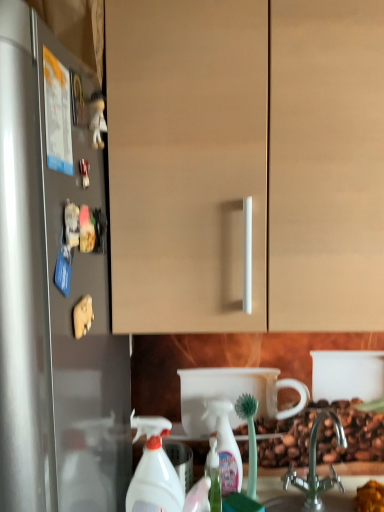
Locate an element on the screen. The width and height of the screenshot is (384, 512). white plastic spray bottle at lower center, which is the 2th cleaning product in left-to-right order is located at coordinates (226, 447).

This screenshot has height=512, width=384. What are the coordinates of `translucent plastic soap dispenser at lower center` in the screenshot? It's located at (213, 476).

In order to face silver metallic faucet at lower center, should I rotate leftwards or rightwards?

You should look right and rotate roughly 16.482 degrees.

Where is `white plastic spray bottle at lower center, which is the first cleaning product from back to front`? This screenshot has height=512, width=384. white plastic spray bottle at lower center, which is the first cleaning product from back to front is located at coordinates (226, 447).

Are white plastic spray bottle at lower center, the 1th cleaning product viewed from the left, and white plastic spray bottle at lower center, which is the first cleaning product from back to front, making contact?

No, white plastic spray bottle at lower center, the 1th cleaning product viewed from the left, is not making contact with white plastic spray bottle at lower center, which is the first cleaning product from back to front.

Considering the positions of points (163, 468) and (232, 441), is point (163, 468) closer to camera compared to point (232, 441)?

Yes, it is in front of point (232, 441).

Is white plastic spray bottle at lower center, arranged as the first cleaning product when viewed from the front, aimed at white plastic spray bottle at lower center, which appears as the first cleaning product when viewed from the right?

No, white plastic spray bottle at lower center, arranged as the first cleaning product when viewed from the front, is not aimed at white plastic spray bottle at lower center, which appears as the first cleaning product when viewed from the right.

Who is bigger, white plastic spray bottle at lower center, which is the first cleaning product from back to front, or silver metallic faucet at lower center?

With larger size is silver metallic faucet at lower center.

Is white plastic spray bottle at lower center, which is the 2th cleaning product in left-to-right order, directly adjacent to silver metallic faucet at lower center?

No, white plastic spray bottle at lower center, which is the 2th cleaning product in left-to-right order, is not with silver metallic faucet at lower center.

Is white plastic spray bottle at lower center, which appears as the first cleaning product when viewed from the right, oriented towards silver metallic faucet at lower center?

No, white plastic spray bottle at lower center, which appears as the first cleaning product when viewed from the right, is not oriented towards silver metallic faucet at lower center.

Which is more to the left, white plastic spray bottle at lower center, which is the first cleaning product from back to front, or silver metallic faucet at lower center?

white plastic spray bottle at lower center, which is the first cleaning product from back to front, is more to the left.

Looking at this image, what's the angular difference between translucent plastic soap dispenser at lower center and white plastic spray bottle at lower center, which ranks as the second cleaning product in right-to-left order,'s facing directions?

There is a 0.0064-degree angle between the facing directions of translucent plastic soap dispenser at lower center and white plastic spray bottle at lower center, which ranks as the second cleaning product in right-to-left order.

Is translucent plastic soap dispenser at lower center next to white plastic spray bottle at lower center, which ranks as the second cleaning product in right-to-left order, and touching it?

They are not placed beside each other.

In the image, is translucent plastic soap dispenser at lower center on the left side or the right side of white plastic spray bottle at lower center, which ranks as the second cleaning product in right-to-left order?

translucent plastic soap dispenser at lower center is positioned on white plastic spray bottle at lower center, which ranks as the second cleaning product in right-to-left order,'s right side.

From the image's perspective, between translucent plastic soap dispenser at lower center and white plastic spray bottle at lower center, arranged as the first cleaning product when viewed from the front, who is located below?

translucent plastic soap dispenser at lower center is shown below in the image.

Would you say white plastic spray bottle at lower center, arranged as the first cleaning product when viewed from the front, is inside or outside translucent plastic soap dispenser at lower center?

white plastic spray bottle at lower center, arranged as the first cleaning product when viewed from the front, is not enclosed by translucent plastic soap dispenser at lower center.

Considering the relative sizes of white plastic spray bottle at lower center, which ranks as the second cleaning product in right-to-left order, and translucent plastic soap dispenser at lower center in the image provided, is white plastic spray bottle at lower center, which ranks as the second cleaning product in right-to-left order, shorter than translucent plastic soap dispenser at lower center?

In fact, white plastic spray bottle at lower center, which ranks as the second cleaning product in right-to-left order, may be taller than translucent plastic soap dispenser at lower center.

How different are the orientations of white plastic spray bottle at lower center, arranged as the first cleaning product when viewed from the front, and translucent plastic soap dispenser at lower center in degrees?

The angular difference between white plastic spray bottle at lower center, arranged as the first cleaning product when viewed from the front, and translucent plastic soap dispenser at lower center is 0.0064 degrees.

Does white plastic spray bottle at lower center, the 1th cleaning product viewed from the left, turn towards translucent plastic soap dispenser at lower center?

No, white plastic spray bottle at lower center, the 1th cleaning product viewed from the left, is not aimed at translucent plastic soap dispenser at lower center.

From the image's perspective, is silver metallic faucet at lower center positioned above or below translucent plastic soap dispenser at lower center?

silver metallic faucet at lower center is above translucent plastic soap dispenser at lower center.

Identify the location of tap that is above the translucent plastic soap dispenser at lower center (from the image's perspective). (315, 464).

Is point (314, 508) closer or farther from the camera than point (215, 451)?

Clearly, point (314, 508) is closer to the camera than point (215, 451).

Is silver metallic faucet at lower center bigger than translucent plastic soap dispenser at lower center?

Yes, silver metallic faucet at lower center is bigger than translucent plastic soap dispenser at lower center.

Considering the relative sizes of translucent plastic soap dispenser at lower center and silver metallic faucet at lower center in the image provided, is translucent plastic soap dispenser at lower center shorter than silver metallic faucet at lower center?

Indeed, translucent plastic soap dispenser at lower center has a lesser height compared to silver metallic faucet at lower center.

Considering the relative sizes of translucent plastic soap dispenser at lower center and silver metallic faucet at lower center in the image provided, is translucent plastic soap dispenser at lower center bigger than silver metallic faucet at lower center?

Actually, translucent plastic soap dispenser at lower center might be smaller than silver metallic faucet at lower center.

Does translucent plastic soap dispenser at lower center have a lesser width compared to silver metallic faucet at lower center?

Yes, translucent plastic soap dispenser at lower center is thinner than silver metallic faucet at lower center.

Is translucent plastic soap dispenser at lower center positioned with its back to silver metallic faucet at lower center?

No, translucent plastic soap dispenser at lower center's orientation is not away from silver metallic faucet at lower center.

Considering the positions of objects silver metallic faucet at lower center and white plastic spray bottle at lower center, which is the first cleaning product from back to front, in the image provided, who is in front, silver metallic faucet at lower center or white plastic spray bottle at lower center, which is the first cleaning product from back to front,?

silver metallic faucet at lower center is more forward.

Is silver metallic faucet at lower center oriented towards white plastic spray bottle at lower center, the 2th cleaning product positioned from the front?

No, silver metallic faucet at lower center is not oriented towards white plastic spray bottle at lower center, the 2th cleaning product positioned from the front.

Between point (304, 490) and point (227, 490), which one is positioned behind?

Point (304, 490)

Which is more to the right, silver metallic faucet at lower center or white plastic spray bottle at lower center, which is the 2th cleaning product in left-to-right order?

silver metallic faucet at lower center.

This screenshot has height=512, width=384. I want to click on cleaning product in front of the white plastic spray bottle at lower center, which appears as the first cleaning product when viewed from the right, so click(153, 471).

Find the location of a particular element. The width and height of the screenshot is (384, 512). the 1st cleaning product to the left when counting from the silver metallic faucet at lower center is located at coordinates (226, 447).

Which object lies further to the anchor point white plastic spray bottle at lower center, the 2th cleaning product positioned from the front, white plastic spray bottle at lower center, arranged as the first cleaning product when viewed from the front, or translucent plastic soap dispenser at lower center?

white plastic spray bottle at lower center, arranged as the first cleaning product when viewed from the front, lies further to white plastic spray bottle at lower center, the 2th cleaning product positioned from the front, than the other object.

Looking at the image, which one is located closer to silver metallic faucet at lower center, translucent plastic soap dispenser at lower center or white plastic spray bottle at lower center, which appears as the first cleaning product when viewed from the right?

white plastic spray bottle at lower center, which appears as the first cleaning product when viewed from the right, lies closer to silver metallic faucet at lower center than the other object.

Which object lies nearer to the anchor point white plastic spray bottle at lower center, which is the 2th cleaning product in left-to-right order, silver metallic faucet at lower center or white plastic spray bottle at lower center, which ranks as the second cleaning product in right-to-left order?

The object closer to white plastic spray bottle at lower center, which is the 2th cleaning product in left-to-right order, is silver metallic faucet at lower center.

Which object lies nearer to the anchor point translucent plastic soap dispenser at lower center, silver metallic faucet at lower center or white plastic spray bottle at lower center, which ranks as the second cleaning product in right-to-left order?

white plastic spray bottle at lower center, which ranks as the second cleaning product in right-to-left order, lies closer to translucent plastic soap dispenser at lower center than the other object.

Looking at this image, based on their spatial positions, is translucent plastic soap dispenser at lower center or white plastic spray bottle at lower center, the 1th cleaning product viewed from the left, closer to white plastic spray bottle at lower center, which is the 2th cleaning product in left-to-right order?

Result: translucent plastic soap dispenser at lower center is closer to white plastic spray bottle at lower center, which is the 2th cleaning product in left-to-right order.

Looking at the image, which one is located closer to white plastic spray bottle at lower center, the 2th cleaning product positioned from the front, silver metallic faucet at lower center or translucent plastic soap dispenser at lower center?

translucent plastic soap dispenser at lower center is positioned closer to the anchor white plastic spray bottle at lower center, the 2th cleaning product positioned from the front.

Considering their positions, is white plastic spray bottle at lower center, the 2th cleaning product positioned from the front, positioned further to silver metallic faucet at lower center than white plastic spray bottle at lower center, arranged as the first cleaning product when viewed from the front?

Based on the image, white plastic spray bottle at lower center, arranged as the first cleaning product when viewed from the front, appears to be further to silver metallic faucet at lower center.

Based on their spatial positions, is white plastic spray bottle at lower center, the second cleaning product viewed from the back, or silver metallic faucet at lower center further from white plastic spray bottle at lower center, which appears as the first cleaning product when viewed from the right?

Among the two, white plastic spray bottle at lower center, the second cleaning product viewed from the back, is located further to white plastic spray bottle at lower center, which appears as the first cleaning product when viewed from the right.

Find the location of `bottle situated between white plastic spray bottle at lower center, the 1th cleaning product viewed from the left, and silver metallic faucet at lower center from left to right`. bottle situated between white plastic spray bottle at lower center, the 1th cleaning product viewed from the left, and silver metallic faucet at lower center from left to right is located at coordinates (213, 476).

Find the location of `cleaning product located between translucent plastic soap dispenser at lower center and silver metallic faucet at lower center in the left-right direction`. cleaning product located between translucent plastic soap dispenser at lower center and silver metallic faucet at lower center in the left-right direction is located at coordinates (226, 447).

The width and height of the screenshot is (384, 512). I want to click on bottle between white plastic spray bottle at lower center, the second cleaning product viewed from the back, and white plastic spray bottle at lower center, which appears as the first cleaning product when viewed from the right, from front to back, so tap(213, 476).

At what (x,y) coordinates should I click in order to perform the action: click on cleaning product between white plastic spray bottle at lower center, arranged as the first cleaning product when viewed from the front, and silver metallic faucet at lower center. Please return your answer as a coordinate pair (x, y). The width and height of the screenshot is (384, 512). Looking at the image, I should click on point(226,447).